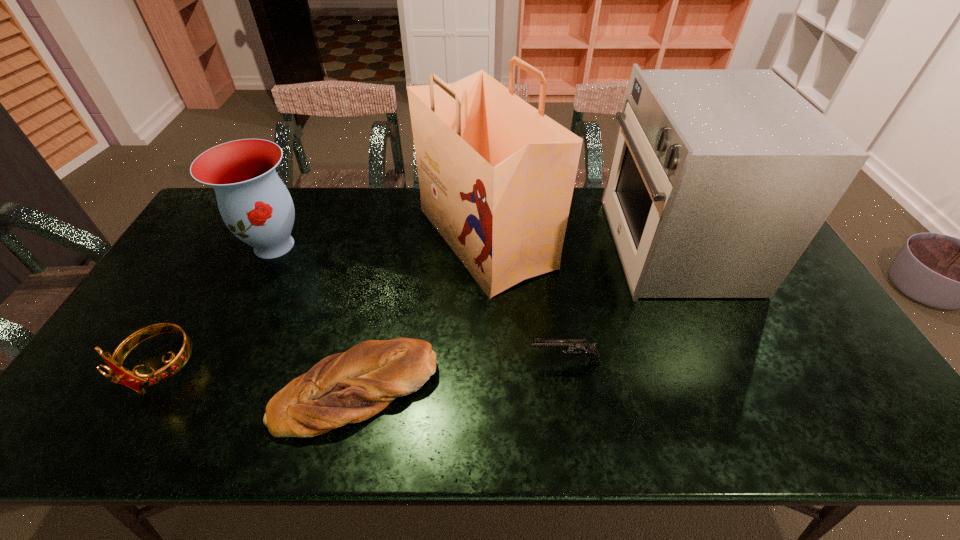
Where is `vase at the far edge`? This screenshot has width=960, height=540. vase at the far edge is located at coordinates (256, 206).

The image size is (960, 540). Identify the location of object that is at the near edge. (350, 387).

I want to click on object that is at the left edge, so click(119, 374).

At what (x,y) coordinates should I click in order to perform the action: click on object that is at the right edge. Please return your answer as a coordinate pair (x, y). The width and height of the screenshot is (960, 540). Looking at the image, I should click on (719, 179).

At what (x,y) coordinates should I click in order to perform the action: click on object located at the far right corner. Please return your answer as a coordinate pair (x, y). This screenshot has height=540, width=960. Looking at the image, I should click on (719, 179).

Locate an element on the screen. This screenshot has height=540, width=960. vacant space at the far edge is located at coordinates (348, 197).

Locate an element on the screen. free location at the near edge is located at coordinates (157, 413).

Where is `vacant area at the left edge`? vacant area at the left edge is located at coordinates (221, 250).

Locate an element on the screen. blank area at the near left corner is located at coordinates (125, 409).

Locate an element on the screen. The height and width of the screenshot is (540, 960). free point between the third tallest object and the grocery bag is located at coordinates (380, 242).